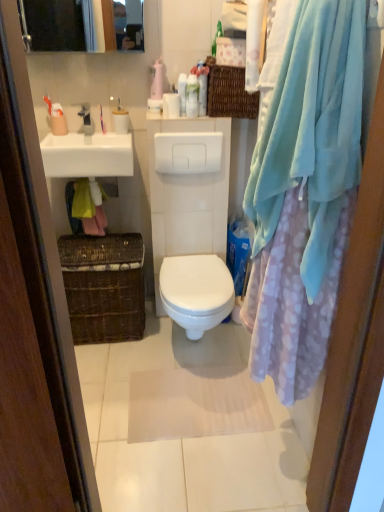
Identify the location of vacant space in front of matte plastic toothbrush at upper left, the second toiletry in the left-to-right sequence. (109, 140).